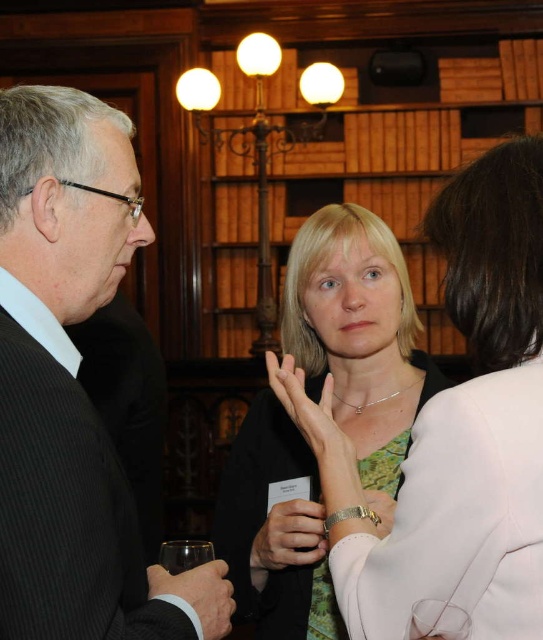
You are organizing a coat rack for guests at this event. You have a coat hanger that can only hold items up to the size of the black smooth suit at lower left. Can the white leather jacket at center be hung on this hanger?

The white leather jacket at center is bigger than the black smooth suit at lower left, so it cannot be hung on the hanger designed for the black smooth suit at lower left due to its larger size.

You are a photographer at this event and want to capture a photo of the white leather jacket at center and the black smooth suit at lower left. Which object should you focus on first if you want to include both in the frame without moving the camera?

The white leather jacket at center is taller than the black smooth suit at lower left, so you should focus on the white leather jacket at center first to ensure its full height fits in the frame while still capturing the black smooth suit at lower left.